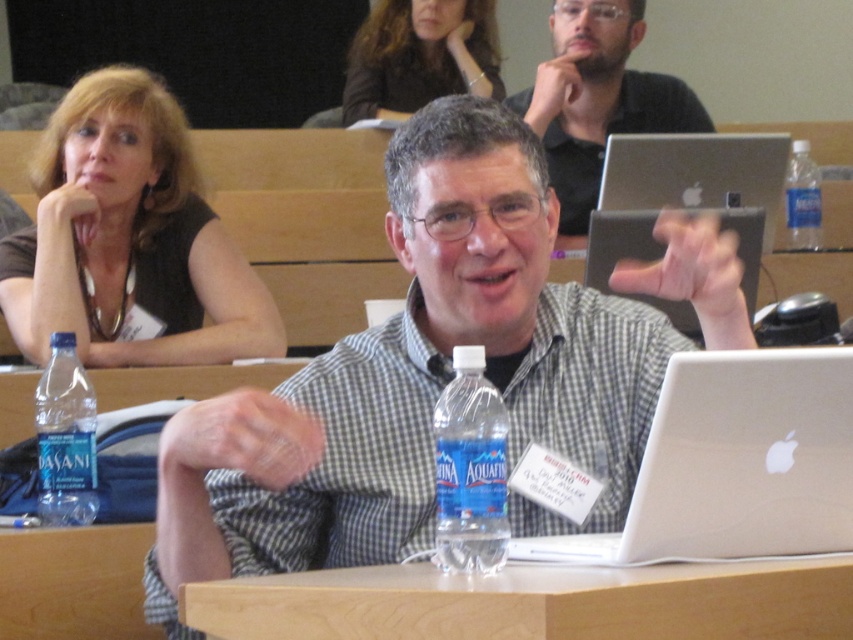
You are a photographer taking a picture of the scene. You notice the matte black shirt at upper left and the dark brown hair at upper center. Which object should you focus on first to ensure both are in sharp focus?

You should focus on the matte black shirt at upper left first because it is closer to the viewer than the dark brown hair at upper center. By focusing on the closer object, the depth of field may also keep the farther object in focus.